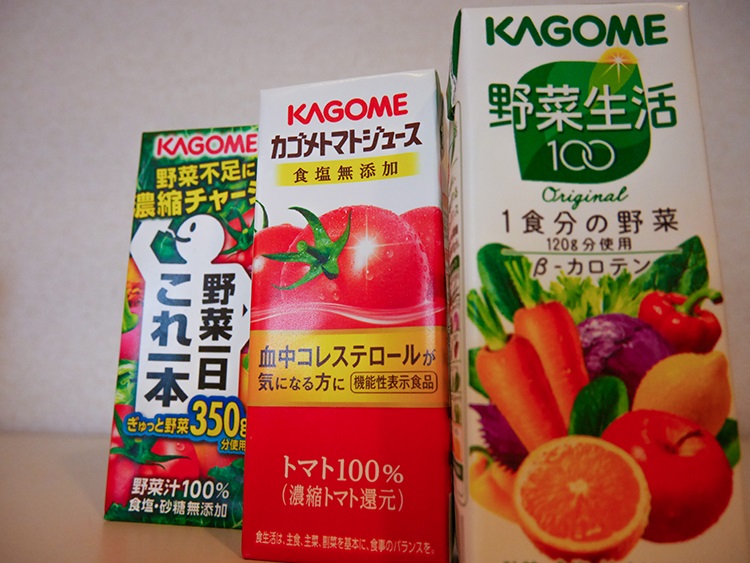
Where is `table`? table is located at coordinates (55, 487).